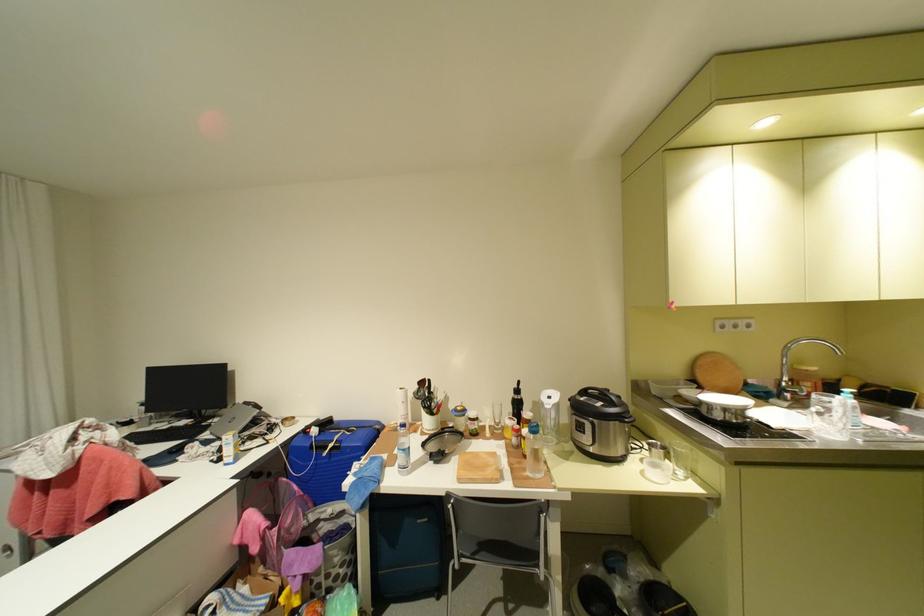
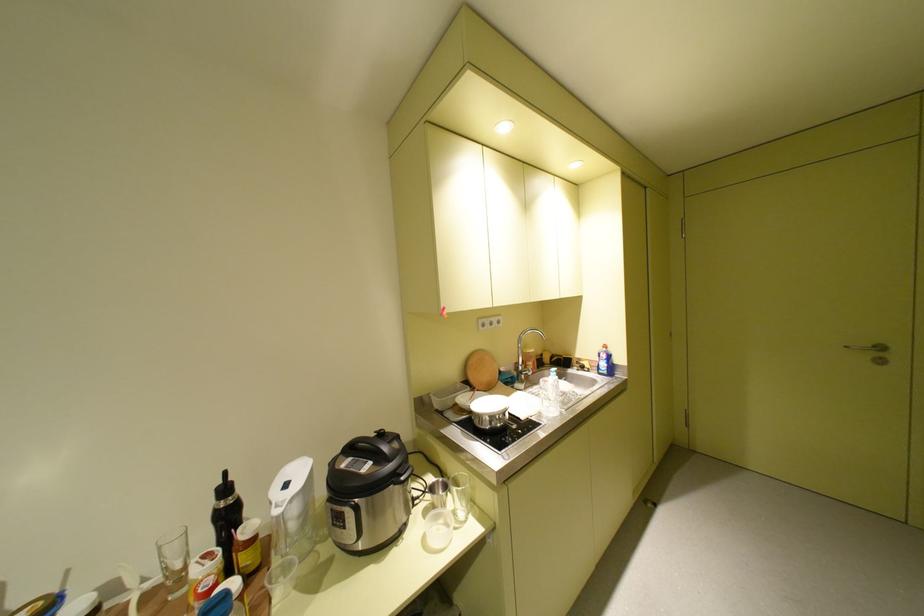
Locate, in the second image, the point that corresponds to (x=784, y=391) in the first image.

(526, 374)